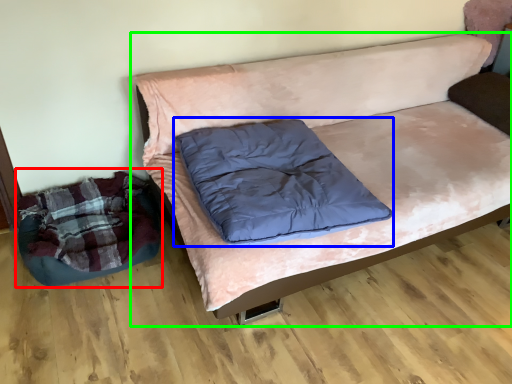
Question: Which object is positioned farthest from bean bag chair (highlighted by a red box)? Select from pillow (highlighted by a blue box) and studio couch (highlighted by a green box).

Choices:
 (A) pillow
 (B) studio couch

Answer: (B)